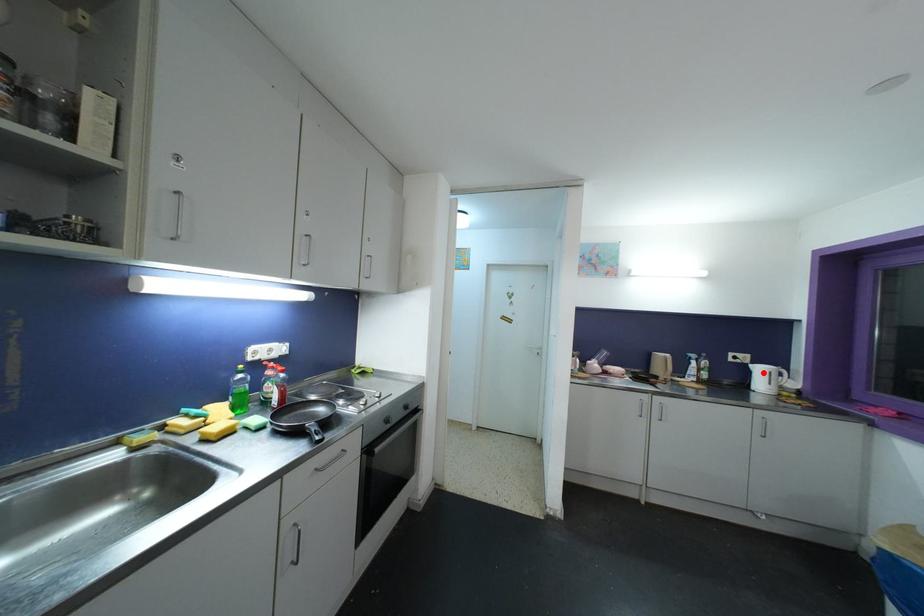
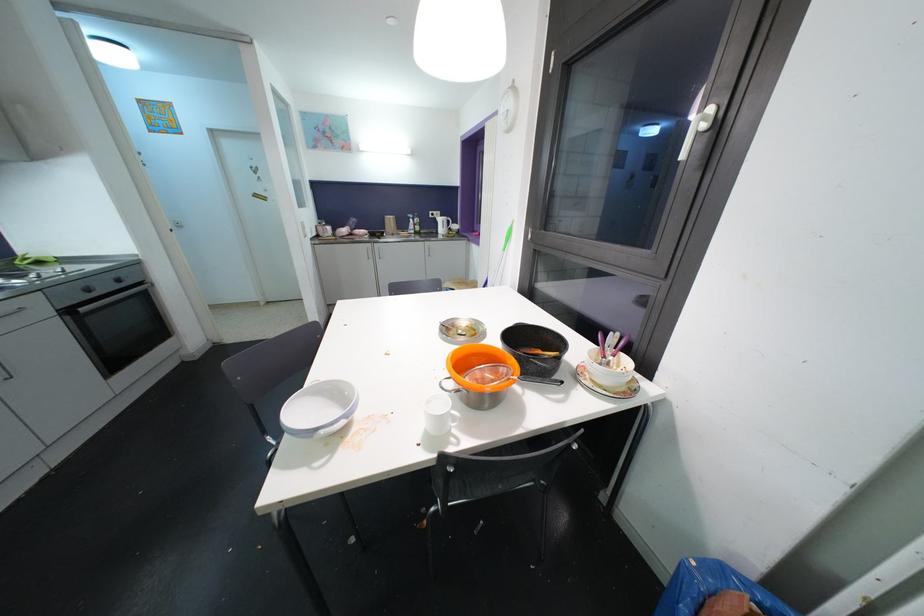
Question: I am providing you with two images of the same scene from different viewpoints. Image1 has a red point marked. In image2, the corresponding 3D location appears at what relative position? Reply with the corresponding letter.

Choices:
 (A) Closer
 (B) Farther

Answer: (A)